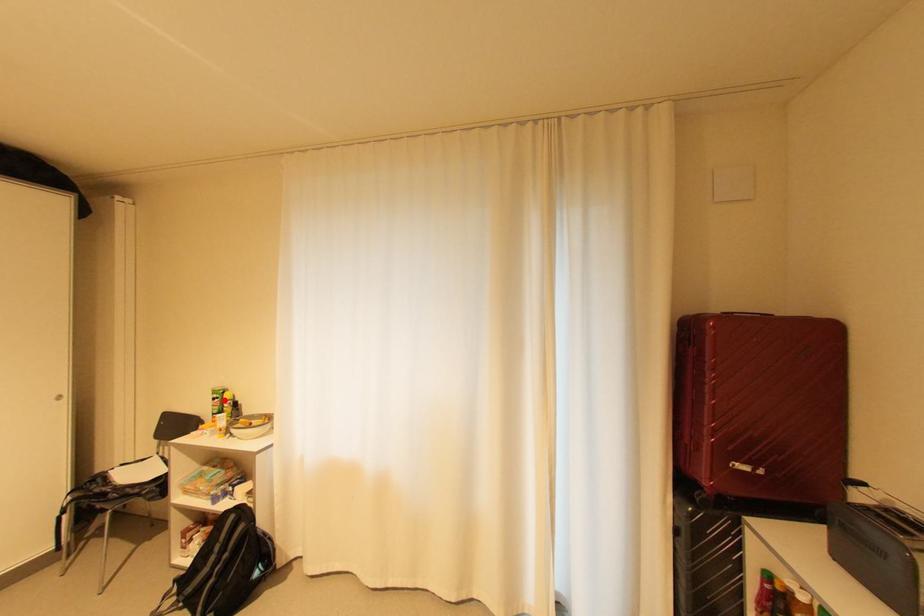
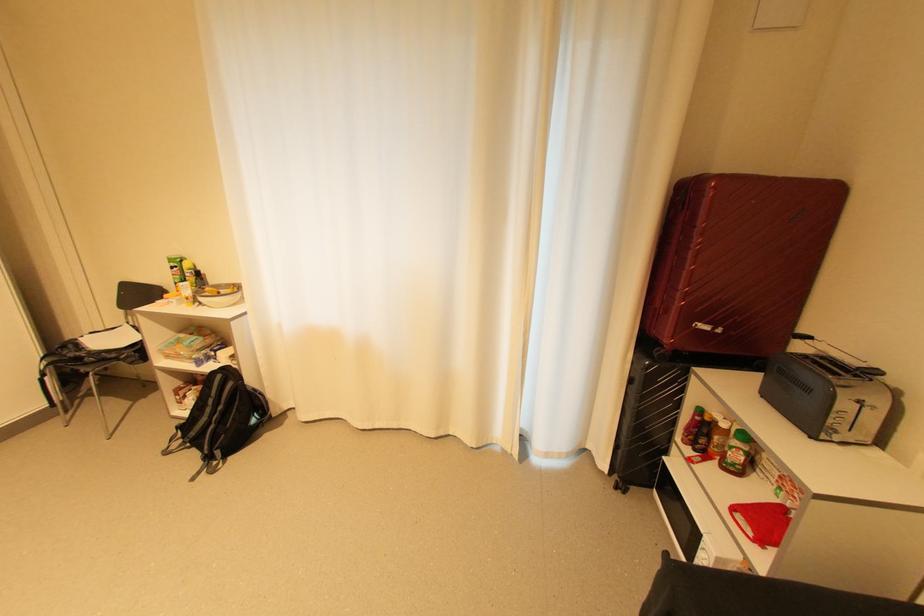
In the second image, find the point that corresponds to the highlighted location in the first image.

(184, 270)